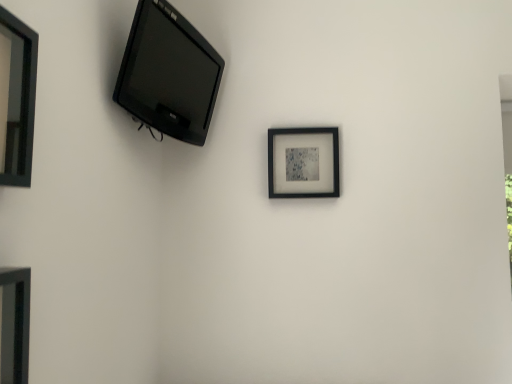
Question: Does black glossy picture frame at upper left, which appears as the first picture frame when viewed from the left, have a greater width compared to black matte picture frame at center, the third picture frame in the front-to-back sequence?

Choices:
 (A) no
 (B) yes

Answer: (B)

Question: Is black glossy picture frame at upper left, marked as the 3th picture frame in a right-to-left arrangement, smaller than black matte picture frame at center, the third picture frame in the left-to-right sequence?

Choices:
 (A) yes
 (B) no

Answer: (B)

Question: Is black glossy picture frame at upper left, marked as the 3th picture frame in a right-to-left arrangement, bigger than black matte picture frame at center, the third picture frame in the left-to-right sequence?

Choices:
 (A) no
 (B) yes

Answer: (B)

Question: From a real-world perspective, is black glossy picture frame at upper left, which appears as the 2th picture frame when viewed from the back, below black matte picture frame at center, positioned as the first picture frame in back-to-front order?

Choices:
 (A) yes
 (B) no

Answer: (A)

Question: Is black glossy picture frame at upper left, the 2th picture frame when ordered from front to back, outside of black matte picture frame at center, positioned as the first picture frame in back-to-front order?

Choices:
 (A) yes
 (B) no

Answer: (A)

Question: Does point (19, 370) appear closer or farther from the camera than point (329, 160)?

Choices:
 (A) farther
 (B) closer

Answer: (B)

Question: Looking at the image, does matte black picture frame at lower left, which appears as the second picture frame when viewed from the right, seem bigger or smaller compared to black matte picture frame at center, the 1th picture frame when ordered from right to left?

Choices:
 (A) small
 (B) big

Answer: (B)

Question: In terms of width, does matte black picture frame at lower left, which appears as the second picture frame when viewed from the right, look wider or thinner when compared to black matte picture frame at center, the third picture frame in the left-to-right sequence?

Choices:
 (A) thin
 (B) wide

Answer: (B)

Question: From the image's perspective, is matte black picture frame at lower left, which appears as the second picture frame when viewed from the right, above or below black matte picture frame at center, the third picture frame in the left-to-right sequence?

Choices:
 (A) above
 (B) below

Answer: (B)

Question: From a real-world perspective, is matte black picture frame at lower left, which appears as the second picture frame when viewed from the right, physically located above or below matte black tv at upper left?

Choices:
 (A) below
 (B) above

Answer: (A)

Question: In the image, is matte black picture frame at lower left, which is counted as the 1th picture frame, starting from the front, positioned in front of or behind matte black tv at upper left?

Choices:
 (A) behind
 (B) front

Answer: (B)

Question: Considering the positions of point (5, 362) and point (199, 51), is point (5, 362) closer or farther from the camera than point (199, 51)?

Choices:
 (A) farther
 (B) closer

Answer: (B)

Question: From the image's perspective, is matte black picture frame at lower left, which appears as the second picture frame when viewed from the right, located above or below matte black tv at upper left?

Choices:
 (A) above
 (B) below

Answer: (B)

Question: Does point (8, 99) appear closer or farther from the camera than point (6, 289)?

Choices:
 (A) farther
 (B) closer

Answer: (A)

Question: From the image's perspective, relative to matte black picture frame at lower left, which is counted as the 1th picture frame, starting from the front, is black glossy picture frame at upper left, the 2th picture frame when ordered from front to back, above or below?

Choices:
 (A) above
 (B) below

Answer: (A)